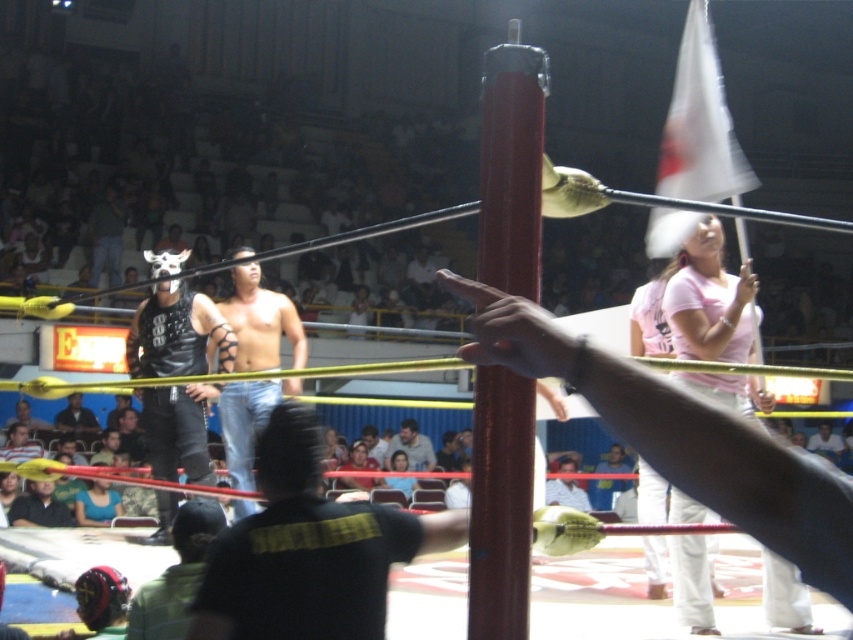
You are a stagehand in the wrestling arena and need to place a 6 feet long banner between the shiny red pole at center and the referee. Can you fit it without bending the banner?

The distance between the shiny red pole at center and the referee is 6.23 feet. Since the banner is 6 feet long, it can fit comfortably without bending.